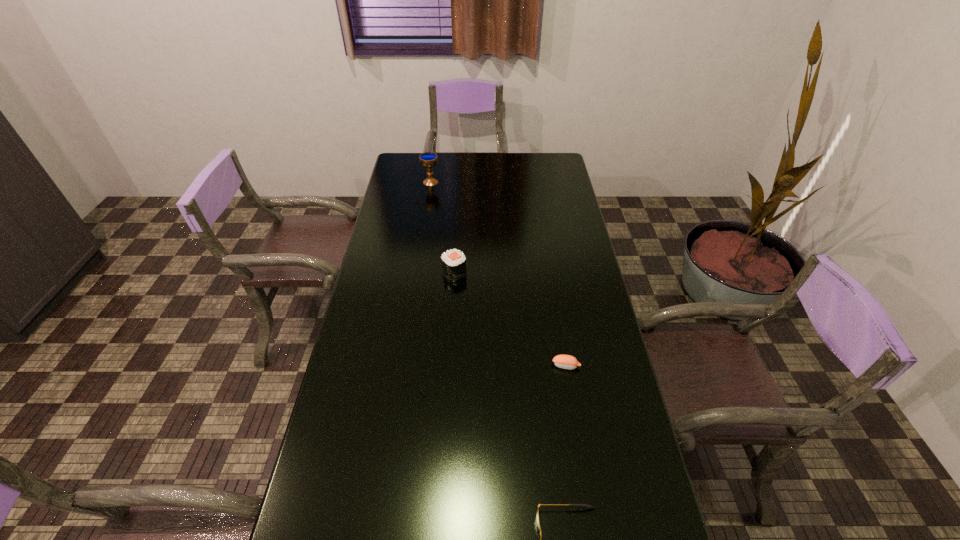
In order to click on object that is at the left edge in this screenshot , I will do `click(428, 160)`.

At what (x,y) coordinates should I click in order to perform the action: click on object present at the right edge. Please return your answer as a coordinate pair (x, y). The image size is (960, 540). Looking at the image, I should click on (569, 362).

The height and width of the screenshot is (540, 960). I want to click on object that is at the far left corner, so click(x=428, y=160).

Locate an element on the screen. vacant region at the far edge of the desktop is located at coordinates (502, 175).

Locate an element on the screen. The width and height of the screenshot is (960, 540). free point at the left edge is located at coordinates (334, 393).

In the image, there is a desktop. At what (x,y) coordinates should I click in order to perform the action: click on free space at the right edge. Please return your answer as a coordinate pair (x, y). Looking at the image, I should click on (561, 341).

Identify the location of vacant space at the far left corner of the desktop. (407, 156).

Image resolution: width=960 pixels, height=540 pixels. Identify the location of blank area at the far right corner. (534, 153).

Where is `vacant point located between the chalice and the right sushi`? The image size is (960, 540). vacant point located between the chalice and the right sushi is located at coordinates (498, 274).

Locate an element on the screen. The width and height of the screenshot is (960, 540). vacant space that's between the second nearest object and the farther sushi is located at coordinates (510, 319).